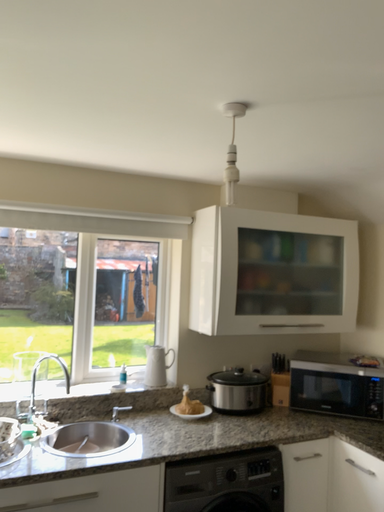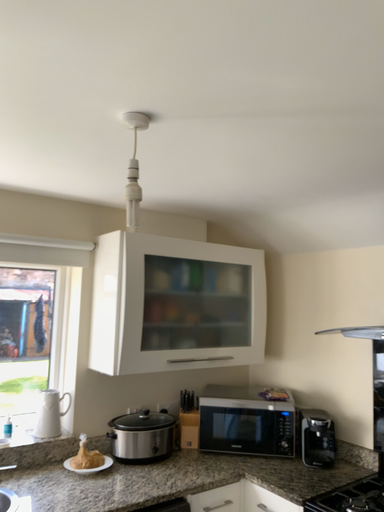
Question: Which way did the camera rotate in the video?

Choices:
 (A) rotated left
 (B) rotated right

Answer: (B)